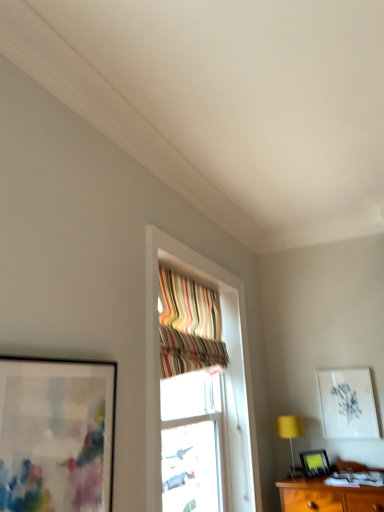
What do you see at coordinates (315, 463) in the screenshot? I see `matte black picture frame at lower right, which is the third picture frame in top-to-bottom order` at bounding box center [315, 463].

Image resolution: width=384 pixels, height=512 pixels. In order to click on matte black picture frame at lower right, which is the third picture frame in top-to-bottom order in this screenshot , I will do `click(315, 463)`.

Find the location of a particular element. This screenshot has height=512, width=384. curtain on the left of the white paper at upper right, which appears as the second picture frame when viewed from the top is located at coordinates (189, 326).

From a real-world perspective, does white paper at upper right, positioned as the 3th picture frame in front-to-back order, sit lower than striped fabric curtain at upper center?

Yes, from a real-world perspective, white paper at upper right, positioned as the 3th picture frame in front-to-back order, is below striped fabric curtain at upper center.

Visually, is white paper at upper right, the first picture frame when ordered from back to front, positioned to the left or to the right of striped fabric curtain at upper center?

white paper at upper right, the first picture frame when ordered from back to front, is positioned on striped fabric curtain at upper center's right side.

Is point (362, 376) positioned after point (171, 286)?

Yes.

Based on the photo, is striped fabric curtain at upper center taller or shorter than matte black picture frame at left, the 3th picture frame viewed from the right?

striped fabric curtain at upper center is taller than matte black picture frame at left, the 3th picture frame viewed from the right.

Do you think striped fabric curtain at upper center is within matte black picture frame at left, the 3th picture frame viewed from the right, or outside of it?

striped fabric curtain at upper center is located beyond the bounds of matte black picture frame at left, the 3th picture frame viewed from the right.

Can you confirm if striped fabric curtain at upper center is smaller than matte black picture frame at left, placed as the 1th picture frame when sorted from left to right?

No, striped fabric curtain at upper center is not smaller than matte black picture frame at left, placed as the 1th picture frame when sorted from left to right.

Would you say striped fabric curtain at upper center is a long distance from matte black picture frame at left, placed as the 1th picture frame when sorted from left to right?

striped fabric curtain at upper center is near matte black picture frame at left, placed as the 1th picture frame when sorted from left to right, not far away.

Based on the photo, can striped fabric curtain at upper center be found inside yellow fabric table lamp at lower right?

That's incorrect, striped fabric curtain at upper center is not inside yellow fabric table lamp at lower right.

Does yellow fabric table lamp at lower right have a greater height compared to striped fabric curtain at upper center?

No.

Is striped fabric curtain at upper center at the back of yellow fabric table lamp at lower right?

No, yellow fabric table lamp at lower right is not facing away from striped fabric curtain at upper center.

In the scene shown: Between matte black picture frame at left, placed as the 1th picture frame when sorted from left to right, and striped fabric curtain at upper center, which one has smaller size?

matte black picture frame at left, placed as the 1th picture frame when sorted from left to right.

How many degrees apart are the facing directions of matte black picture frame at left, arranged as the third picture frame when viewed from the back, and striped fabric curtain at upper center?

The facing directions of matte black picture frame at left, arranged as the third picture frame when viewed from the back, and striped fabric curtain at upper center are 0.916 degrees apart.

From a real-world perspective, is matte black picture frame at left, marked as the first picture frame in a top-to-bottom arrangement, positioned above or below striped fabric curtain at upper center?

matte black picture frame at left, marked as the first picture frame in a top-to-bottom arrangement, is situated lower than striped fabric curtain at upper center in the real world.

Where is `curtain lying on the right of matte black picture frame at left, placed as the 1th picture frame when sorted from left to right`? curtain lying on the right of matte black picture frame at left, placed as the 1th picture frame when sorted from left to right is located at coordinates (189, 326).

Considering the positions of point (86, 487) and point (315, 466), is point (86, 487) closer or farther from the camera than point (315, 466)?

Point (86, 487).

Considering the sizes of objects matte black picture frame at left, marked as the first picture frame in a top-to-bottom arrangement, and matte black picture frame at lower right, which is the third picture frame in top-to-bottom order, in the image provided, who is bigger, matte black picture frame at left, marked as the first picture frame in a top-to-bottom arrangement, or matte black picture frame at lower right, which is the third picture frame in top-to-bottom order,?

matte black picture frame at left, marked as the first picture frame in a top-to-bottom arrangement, is bigger.

Can we say matte black picture frame at left, acting as the third picture frame starting from the bottom, lies outside matte black picture frame at lower right, the first picture frame positioned from the bottom?

Yes, matte black picture frame at left, acting as the third picture frame starting from the bottom, is outside of matte black picture frame at lower right, the first picture frame positioned from the bottom.

Is white paper at upper right, the first picture frame when ordered from back to front, turned away from matte black picture frame at lower right, the second picture frame from the left?

white paper at upper right, the first picture frame when ordered from back to front, does not have its back to matte black picture frame at lower right, the second picture frame from the left.

Between white paper at upper right, which is counted as the 2th picture frame, starting from the bottom, and matte black picture frame at lower right, the second picture frame from the left, which one is positioned behind?

white paper at upper right, which is counted as the 2th picture frame, starting from the bottom, is more distant.

From the image's perspective, is white paper at upper right, placed as the 3th picture frame when sorted from left to right, located beneath matte black picture frame at lower right, positioned as the 2th picture frame in back-to-front order?

Incorrect, from the image's perspective, white paper at upper right, placed as the 3th picture frame when sorted from left to right, is higher than matte black picture frame at lower right, positioned as the 2th picture frame in back-to-front order.

Is yellow fabric table lamp at lower right far from white paper at upper right, the first picture frame when ordered from back to front?

yellow fabric table lamp at lower right is actually quite close to white paper at upper right, the first picture frame when ordered from back to front.

Is yellow fabric table lamp at lower right located outside white paper at upper right, which is counted as the 2th picture frame, starting from the bottom?

Yes, yellow fabric table lamp at lower right is outside of white paper at upper right, which is counted as the 2th picture frame, starting from the bottom.

From the picture: Can you confirm if yellow fabric table lamp at lower right is wider than white paper at upper right, positioned as the 3th picture frame in front-to-back order?

Correct, the width of yellow fabric table lamp at lower right exceeds that of white paper at upper right, positioned as the 3th picture frame in front-to-back order.

Is yellow fabric table lamp at lower right aimed at white paper at upper right, which is counted as the 2th picture frame, starting from the bottom?

No, yellow fabric table lamp at lower right does not turn towards white paper at upper right, which is counted as the 2th picture frame, starting from the bottom.

At what (x,y) coordinates should I click in order to perform the action: click on the 2nd picture frame counting from the right of the striped fabric curtain at upper center. Please return your answer as a coordinate pair (x, y). This screenshot has height=512, width=384. Looking at the image, I should click on (347, 403).

The image size is (384, 512). I want to click on curtain located above the matte black picture frame at left, marked as the first picture frame in a top-to-bottom arrangement (from the image's perspective), so click(x=189, y=326).

Based on their spatial positions, is matte black picture frame at left, marked as the first picture frame in a top-to-bottom arrangement, or striped fabric curtain at upper center further from yellow fabric table lamp at lower right?

The object further to yellow fabric table lamp at lower right is matte black picture frame at left, marked as the first picture frame in a top-to-bottom arrangement.

From the image, which object appears to be farther from striped fabric curtain at upper center, white paper at upper right, the first picture frame when ordered from back to front, or matte black picture frame at lower right, the first picture frame positioned from the bottom?

Among the two, matte black picture frame at lower right, the first picture frame positioned from the bottom, is located further to striped fabric curtain at upper center.

Estimate the real-world distances between objects in this image. Which object is further from matte black picture frame at lower right, the second picture frame from the left, white paper at upper right, which appears as the second picture frame when viewed from the top, or striped fabric curtain at upper center?

striped fabric curtain at upper center is further to matte black picture frame at lower right, the second picture frame from the left.

Looking at the image, which one is located further to yellow fabric table lamp at lower right, striped fabric curtain at upper center or matte black picture frame at lower right, which is the third picture frame in top-to-bottom order?

striped fabric curtain at upper center is further to yellow fabric table lamp at lower right.

Considering their positions, is yellow fabric table lamp at lower right positioned further to matte black picture frame at left, marked as the first picture frame in a top-to-bottom arrangement, than matte black picture frame at lower right, placed as the second picture frame when sorted from front to back?

matte black picture frame at lower right, placed as the second picture frame when sorted from front to back, is further to matte black picture frame at left, marked as the first picture frame in a top-to-bottom arrangement.

Based on their spatial positions, is striped fabric curtain at upper center or yellow fabric table lamp at lower right further from matte black picture frame at lower right, the 2th picture frame positioned from the right?

Based on the image, striped fabric curtain at upper center appears to be further to matte black picture frame at lower right, the 2th picture frame positioned from the right.

Estimate the real-world distances between objects in this image. Which object is closer to yellow fabric table lamp at lower right, white paper at upper right, which is counted as the 2th picture frame, starting from the bottom, or matte black picture frame at left, the first picture frame when ordered from front to back?

Among the two, white paper at upper right, which is counted as the 2th picture frame, starting from the bottom, is located nearer to yellow fabric table lamp at lower right.

Considering their positions, is matte black picture frame at lower right, placed as the second picture frame when sorted from front to back, positioned further to yellow fabric table lamp at lower right than matte black picture frame at left, placed as the 1th picture frame when sorted from left to right?

matte black picture frame at left, placed as the 1th picture frame when sorted from left to right, lies further to yellow fabric table lamp at lower right than the other object.

This screenshot has height=512, width=384. I want to click on curtain between matte black picture frame at left, arranged as the third picture frame when viewed from the back, and matte black picture frame at lower right, positioned as the 2th picture frame in back-to-front order, from front to back, so click(x=189, y=326).

This screenshot has width=384, height=512. I want to click on table lamp positioned between matte black picture frame at left, the 3th picture frame viewed from the right, and white paper at upper right, which is counted as the 2th picture frame, starting from the bottom, from near to far, so click(x=290, y=434).

At what (x,y) coordinates should I click in order to perform the action: click on table lamp between striped fabric curtain at upper center and matte black picture frame at lower right, the 2th picture frame positioned from the right, in the up-down direction. Please return your answer as a coordinate pair (x, y). The height and width of the screenshot is (512, 384). Looking at the image, I should click on (290, 434).

Image resolution: width=384 pixels, height=512 pixels. Identify the location of table lamp between matte black picture frame at left, the 3th picture frame viewed from the right, and matte black picture frame at lower right, the 2th picture frame positioned from the right, from front to back. (290, 434).